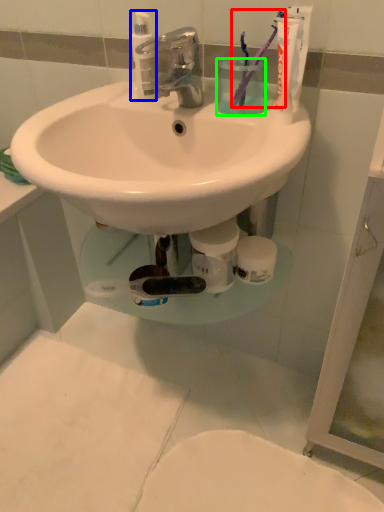
Question: Which object is the closest to the toothbrush (highlighted by a red box)? Choose among these: cleaning product (highlighted by a blue box) or liquid (highlighted by a green box).

Choices:
 (A) cleaning product
 (B) liquid

Answer: (B)